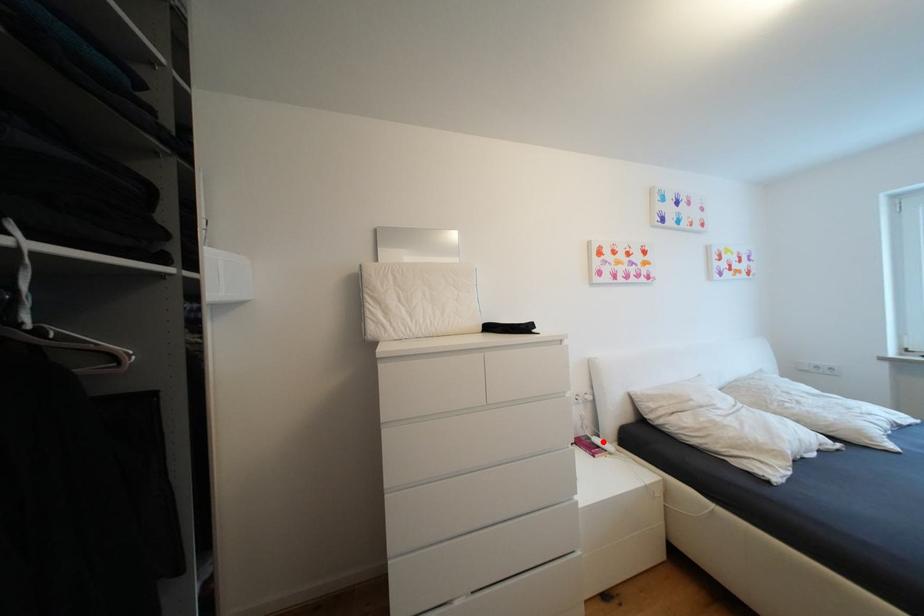
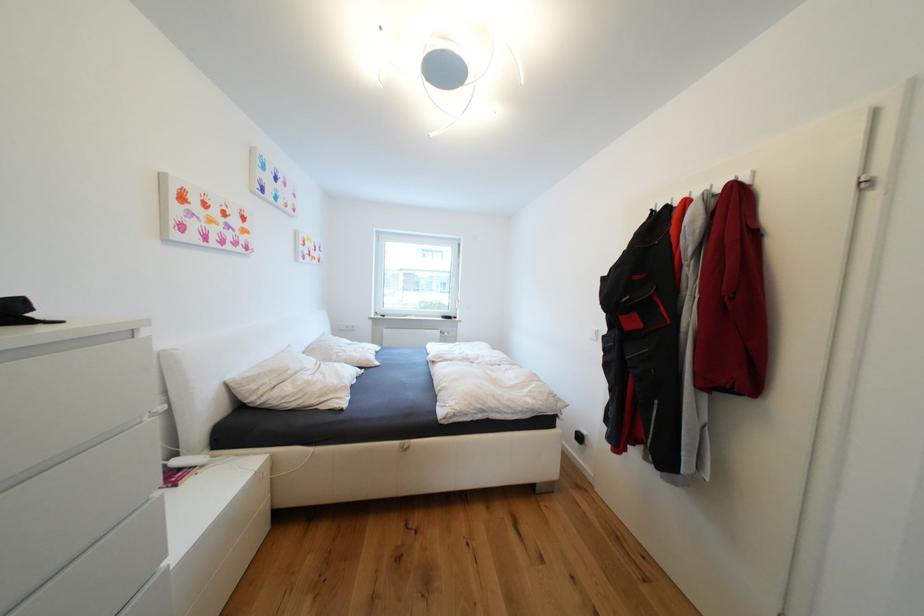
Question: A red point is marked in image1. In image2, is the corresponding 3D point closer to the camera or farther? Reply with the corresponding letter.

Choices:
 (A) The corresponding 3D point is closer.
 (B) The corresponding 3D point is farther.

Answer: (A)